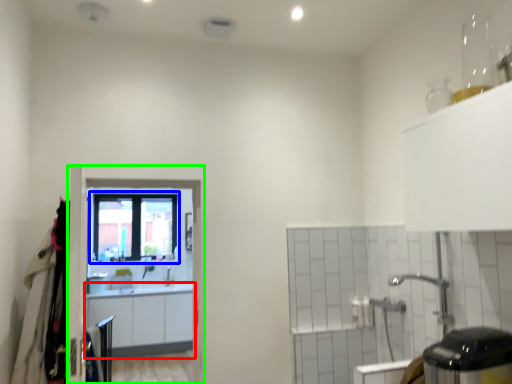
Question: Estimate the real-world distances between objects in this image. Which object is farther from cabinetry (highlighted by a red box), window (highlighted by a blue box) or screen door (highlighted by a green box)?

Choices:
 (A) window
 (B) screen door

Answer: (B)